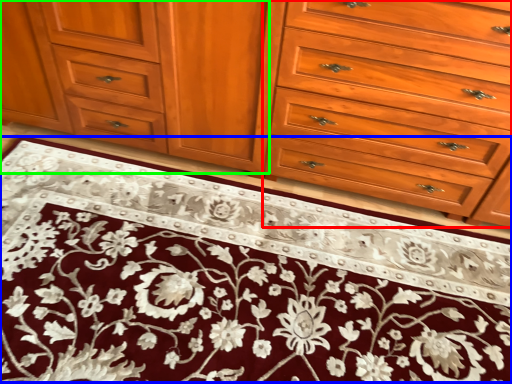
Question: Based on their relative distances, which object is farther from drawer (highlighted by a red box)? Choose from doormat (highlighted by a blue box) and cabinetry (highlighted by a green box).

Choices:
 (A) doormat
 (B) cabinetry

Answer: (A)